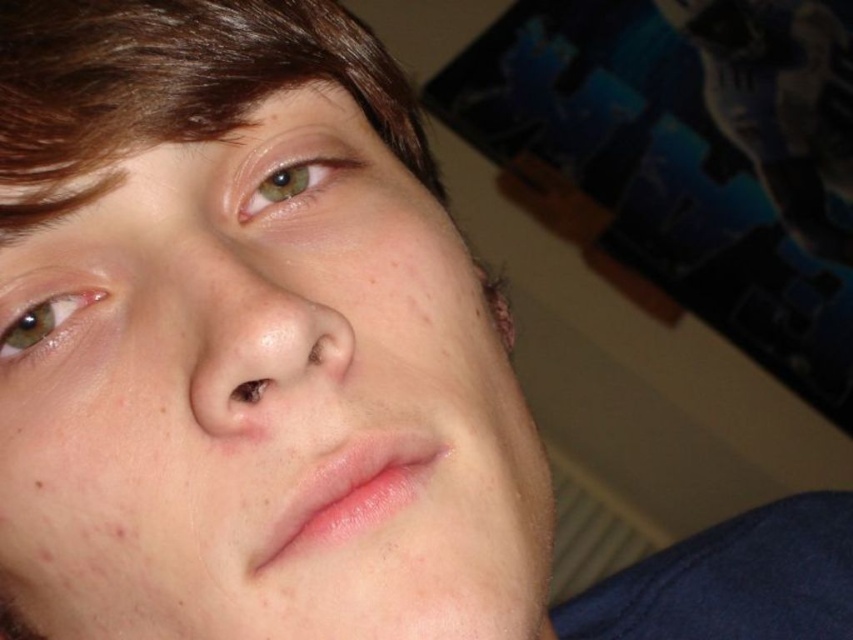
In the scene shown: You are taking a photo of a person and want to focus on their eyes. You notice two points in the image labeled as point (492,349) and point (322,163). Which point should you adjust your focus to ensure the eyes are sharp?

Point (492,349) is further to the camera than point (322,163), so you should focus on point (492,349) to ensure the eyes are sharp.

Based on the scene description, can you determine if the smooth skin face at center is wider than the brown matte eye at lower left?

The smooth skin face at center is wider than the brown matte eye at lower left according to the object descriptions.

Looking at the image, where is the smooth skin face at center in relation to the brown matte eye at lower left?

The smooth skin face at center is to the right of the brown matte eye at lower left.